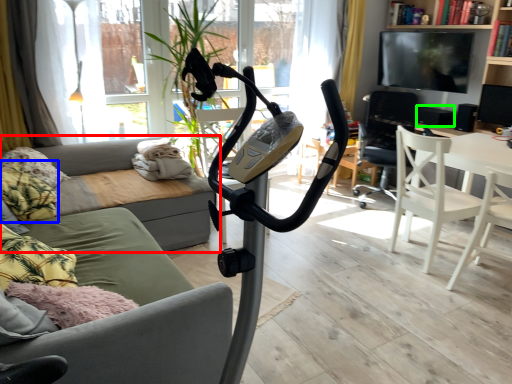
Question: Based on their relative distances, which object is nearer to studio couch (highlighted by a red box)? Choose from pillow (highlighted by a blue box) and speaker (highlighted by a green box).

Choices:
 (A) pillow
 (B) speaker

Answer: (A)